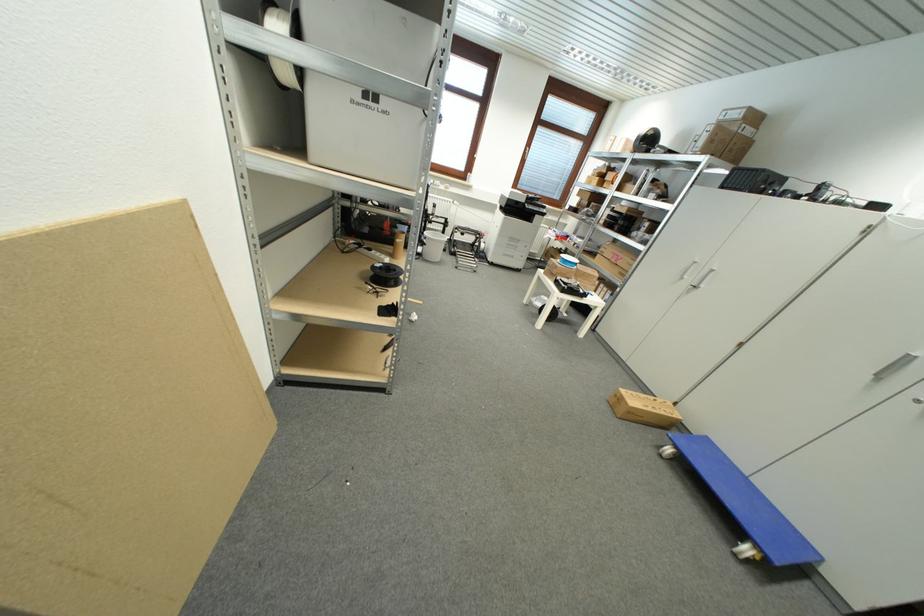
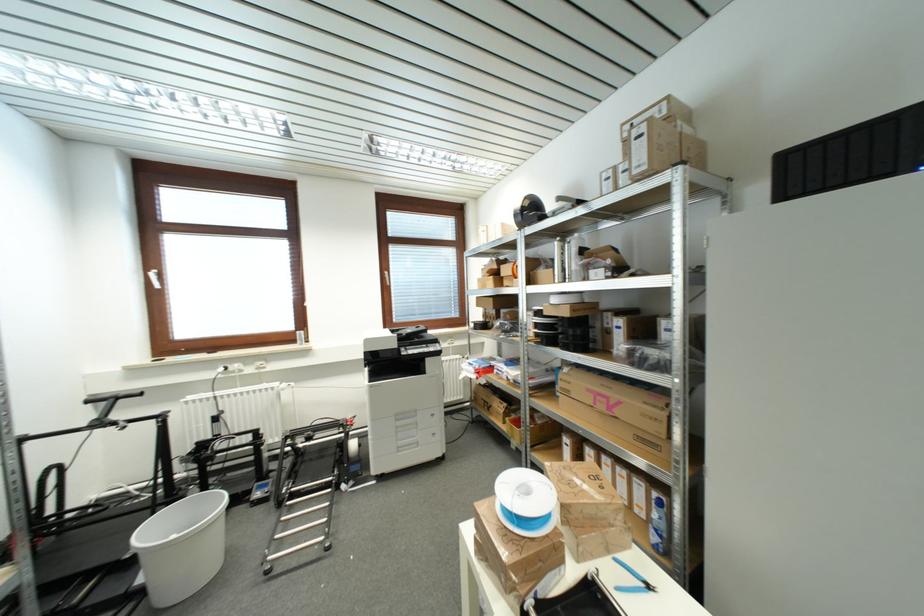
Where in the second image is the point corresponding to (x=516, y=241) from the first image?

(403, 419)